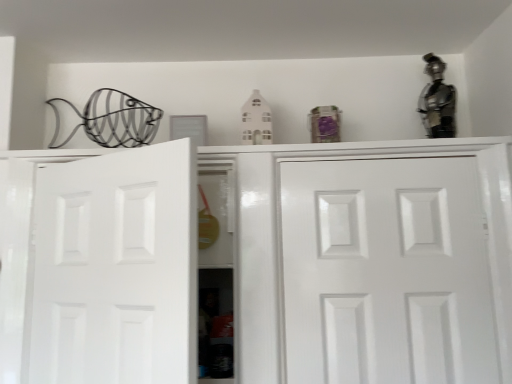
Describe the element at coordinates (116, 268) in the screenshot. I see `white matte door at left, arranged as the first door when viewed from the left` at that location.

Describe the element at coordinates (276, 245) in the screenshot. I see `white glossy cabinet doors at center` at that location.

The width and height of the screenshot is (512, 384). Describe the element at coordinates (437, 101) in the screenshot. I see `metallic silver figurine at upper right` at that location.

Describe the element at coordinates (386, 272) in the screenshot. The height and width of the screenshot is (384, 512). I see `white glossy door at center, the 2th door in the left-to-right sequence` at that location.

Image resolution: width=512 pixels, height=384 pixels. I want to click on white matte door at left, the 2th door positioned from the right, so click(116, 268).

Is white matte door at left, the 2th door positioned from the right, oriented away from metallic silver figurine at upper right?

No, white matte door at left, the 2th door positioned from the right, is not facing the opposite direction of metallic silver figurine at upper right.

Considering the positions of objects white matte door at left, the 2th door positioned from the right, and metallic silver figurine at upper right in the image provided, who is more to the right, white matte door at left, the 2th door positioned from the right, or metallic silver figurine at upper right?

Positioned to the right is metallic silver figurine at upper right.

From the picture: From the image's perspective, which is above, white matte door at left, the 2th door positioned from the right, or metallic silver figurine at upper right?

metallic silver figurine at upper right, from the image's perspective.

In the scene shown: Considering the sizes of objects white matte door at left, arranged as the first door when viewed from the left, and white glossy door at center, the 2th door in the left-to-right sequence, in the image provided, who is wider, white matte door at left, arranged as the first door when viewed from the left, or white glossy door at center, the 2th door in the left-to-right sequence,?

white glossy door at center, the 2th door in the left-to-right sequence.

Between point (168, 292) and point (435, 208), which one is positioned in front?

The point (168, 292) is closer.

Is white matte door at left, arranged as the first door when viewed from the left, not near white glossy door at center, the 1th door when ordered from right to left?

No, white matte door at left, arranged as the first door when viewed from the left, is not far away from white glossy door at center, the 1th door when ordered from right to left.

Is white glossy cabinet doors at center to the left of white matte door at left, the 2th door positioned from the right, from the viewer's perspective?

Incorrect, white glossy cabinet doors at center is not on the left side of white matte door at left, the 2th door positioned from the right.

Who is taller, white glossy cabinet doors at center or white matte door at left, arranged as the first door when viewed from the left?

With more height is white glossy cabinet doors at center.

Is white glossy cabinet doors at center looking in the opposite direction of white matte door at left, arranged as the first door when viewed from the left?

Yes, white glossy cabinet doors at center is positioned with its back facing white matte door at left, arranged as the first door when viewed from the left.

From the image's perspective, would you say white glossy cabinet doors at center is shown under white matte door at left, the 2th door positioned from the right?

Indeed, from the image's perspective, white glossy cabinet doors at center is shown beneath white matte door at left, the 2th door positioned from the right.

Find the location of `figurine on the right of white glossy door at center, the 1th door when ordered from right to left`. figurine on the right of white glossy door at center, the 1th door when ordered from right to left is located at coordinates pos(437,101).

Are metallic silver figurine at upper right and white glossy door at center, the 1th door when ordered from right to left, far apart?

They are positioned close to each other.

Between metallic silver figurine at upper right and white glossy door at center, the 2th door in the left-to-right sequence, which one has more height?

Standing taller between the two is white glossy door at center, the 2th door in the left-to-right sequence.

From the image's perspective, is metallic silver figurine at upper right located beneath white glossy door at center, the 2th door in the left-to-right sequence?

Actually, metallic silver figurine at upper right appears above white glossy door at center, the 2th door in the left-to-right sequence, in the image.

Based on the photo, is metallic silver figurine at upper right at the back of white glossy door at center, the 1th door when ordered from right to left?

No.

How distant is white glossy door at center, the 1th door when ordered from right to left, from metallic silver figurine at upper right?

They are 21.65 inches apart.

Is white glossy door at center, the 2th door in the left-to-right sequence, outside of metallic silver figurine at upper right?

Indeed, white glossy door at center, the 2th door in the left-to-right sequence, is completely outside metallic silver figurine at upper right.

Consider the image. Can you confirm if white glossy door at center, the 1th door when ordered from right to left, is wider than metallic silver figurine at upper right?

Incorrect, the width of white glossy door at center, the 1th door when ordered from right to left, does not surpass that of metallic silver figurine at upper right.

Considering the sizes of objects white matte door at left, arranged as the first door when viewed from the left, and white glossy cabinet doors at center in the image provided, who is taller, white matte door at left, arranged as the first door when viewed from the left, or white glossy cabinet doors at center?

white glossy cabinet doors at center.

Which object is positioned more to the right, white matte door at left, arranged as the first door when viewed from the left, or white glossy cabinet doors at center?

white glossy cabinet doors at center.

Is white matte door at left, arranged as the first door when viewed from the left, in contact with white glossy cabinet doors at center?

They are not placed beside each other.

Measure the distance from white matte door at left, the 2th door positioned from the right, to white glossy cabinet doors at center.

white matte door at left, the 2th door positioned from the right, and white glossy cabinet doors at center are 40.32 centimeters apart.

How far apart are white glossy cabinet doors at center and metallic silver figurine at upper right?

white glossy cabinet doors at center is 15.81 inches away from metallic silver figurine at upper right.

From a real-world perspective, does white glossy cabinet doors at center sit lower than metallic silver figurine at upper right?

Indeed, from a real-world perspective, white glossy cabinet doors at center is positioned beneath metallic silver figurine at upper right.

Are white glossy cabinet doors at center and metallic silver figurine at upper right located far from each other?

white glossy cabinet doors at center is actually quite close to metallic silver figurine at upper right.

From the image's perspective, is white glossy cabinet doors at center under metallic silver figurine at upper right?

Yes.

This screenshot has height=384, width=512. I want to click on figurine that appears behind the white matte door at left, arranged as the first door when viewed from the left, so click(x=437, y=101).

Find the location of a particular element. This screenshot has height=384, width=512. door that appears in front of the white glossy door at center, the 1th door when ordered from right to left is located at coordinates (116, 268).

When comparing their distances from metallic silver figurine at upper right, does white glossy cabinet doors at center or white matte door at left, arranged as the first door when viewed from the left, seem further?

white matte door at left, arranged as the first door when viewed from the left.

Based on their spatial positions, is metallic silver figurine at upper right or white glossy door at center, the 1th door when ordered from right to left, further from white matte door at left, the 2th door positioned from the right?

metallic silver figurine at upper right lies further to white matte door at left, the 2th door positioned from the right, than the other object.

Looking at the image, which one is located closer to white glossy door at center, the 1th door when ordered from right to left, metallic silver figurine at upper right or white matte door at left, arranged as the first door when viewed from the left?

metallic silver figurine at upper right is closer to white glossy door at center, the 1th door when ordered from right to left.

When comparing their distances from white glossy door at center, the 2th door in the left-to-right sequence, does white glossy cabinet doors at center or metallic silver figurine at upper right seem closer?

white glossy cabinet doors at center is positioned closer to the anchor white glossy door at center, the 2th door in the left-to-right sequence.

Based on their spatial positions, is white matte door at left, arranged as the first door when viewed from the left, or metallic silver figurine at upper right further from white glossy door at center, the 2th door in the left-to-right sequence?

Based on the image, white matte door at left, arranged as the first door when viewed from the left, appears to be further to white glossy door at center, the 2th door in the left-to-right sequence.

Based on their spatial positions, is white matte door at left, arranged as the first door when viewed from the left, or white glossy cabinet doors at center closer to metallic silver figurine at upper right?

white glossy cabinet doors at center lies closer to metallic silver figurine at upper right than the other object.

Looking at the image, which one is located further to white matte door at left, arranged as the first door when viewed from the left, white glossy cabinet doors at center or metallic silver figurine at upper right?

metallic silver figurine at upper right.

Considering their positions, is metallic silver figurine at upper right positioned closer to white glossy cabinet doors at center than white glossy door at center, the 2th door in the left-to-right sequence?

The object closer to white glossy cabinet doors at center is white glossy door at center, the 2th door in the left-to-right sequence.

The width and height of the screenshot is (512, 384). Find the location of `cabinetry between white matte door at left, arranged as the first door when viewed from the left, and metallic silver figurine at upper right, in the horizontal direction`. cabinetry between white matte door at left, arranged as the first door when viewed from the left, and metallic silver figurine at upper right, in the horizontal direction is located at coordinates (276, 245).

Find the location of `door located between white matte door at left, the 2th door positioned from the right, and metallic silver figurine at upper right in the left-right direction`. door located between white matte door at left, the 2th door positioned from the right, and metallic silver figurine at upper right in the left-right direction is located at coordinates (386, 272).

Identify the location of cabinetry between white matte door at left, arranged as the first door when viewed from the left, and white glossy door at center, the 2th door in the left-to-right sequence, from left to right. [x=276, y=245].